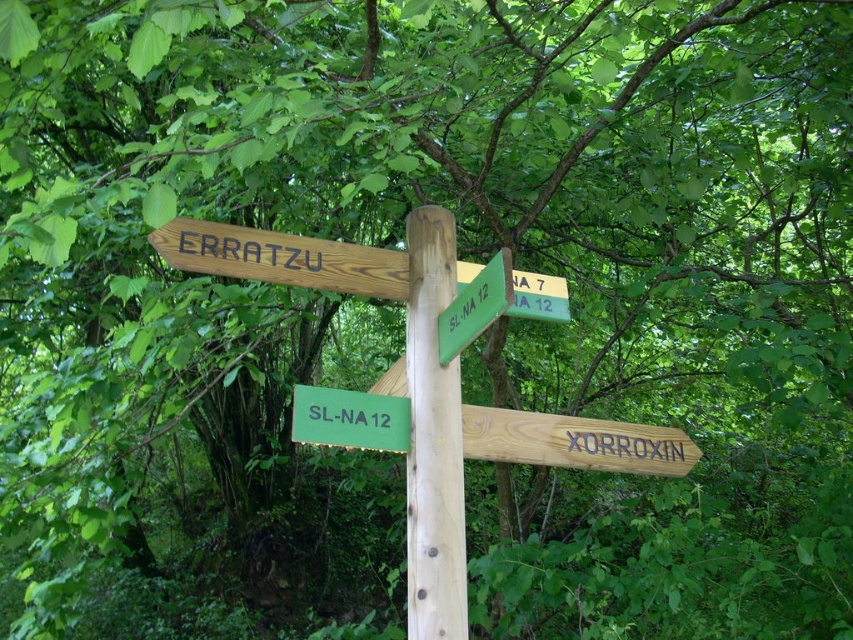
Is wooden signpost at center to the right of wooden signpost at upper center from the viewer's perspective?

Yes, wooden signpost at center is to the right of wooden signpost at upper center.

Who is lower down, wooden signpost at center or wooden signpost at upper center?

Positioned lower is wooden signpost at center.

Is point (405, 236) farther from viewer compared to point (225, 246)?

Yes, point (405, 236) is farther from viewer.

Identify the location of wooden signpost at center. (433, 436).